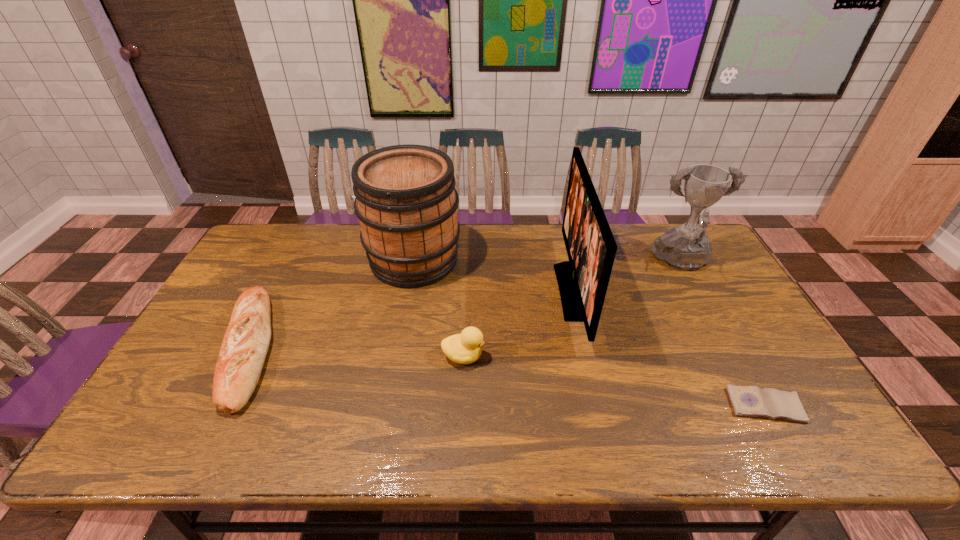
Find the location of a particular element. This screenshot has height=540, width=960. the fourth object from left to right is located at coordinates (591, 248).

Locate an element on the screen. cider is located at coordinates (405, 199).

Where is `award`? The height and width of the screenshot is (540, 960). award is located at coordinates (686, 247).

The height and width of the screenshot is (540, 960). I want to click on duck, so click(x=465, y=348).

Identify the location of baguet. Image resolution: width=960 pixels, height=540 pixels. (246, 341).

Where is `the fifth tallest object`? The height and width of the screenshot is (540, 960). the fifth tallest object is located at coordinates (246, 341).

Where is `diary`? The height and width of the screenshot is (540, 960). diary is located at coordinates (751, 401).

The width and height of the screenshot is (960, 540). Identify the location of free spot located 0.260m on the front-facing side of the monitor. (474, 292).

Locate an element on the screen. The height and width of the screenshot is (540, 960). free space located 0.260m on the front-facing side of the monitor is located at coordinates (474, 292).

This screenshot has height=540, width=960. In order to click on vacant space located on the front-facing side of the monitor in this screenshot , I will do `click(468, 292)`.